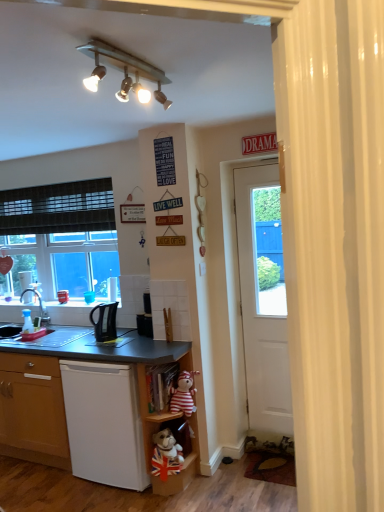
I want to click on free spot to the left of brown textured rug at lower right, so click(237, 475).